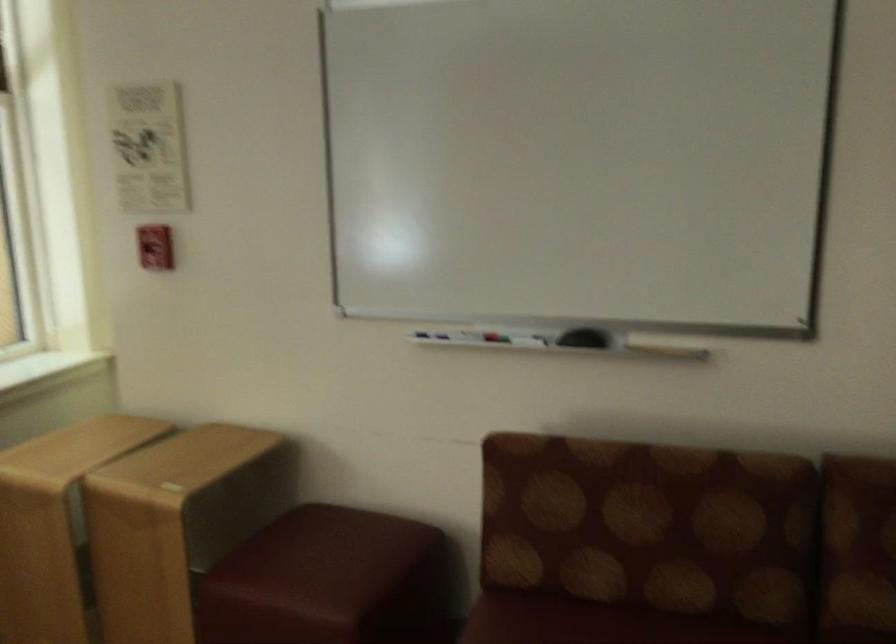
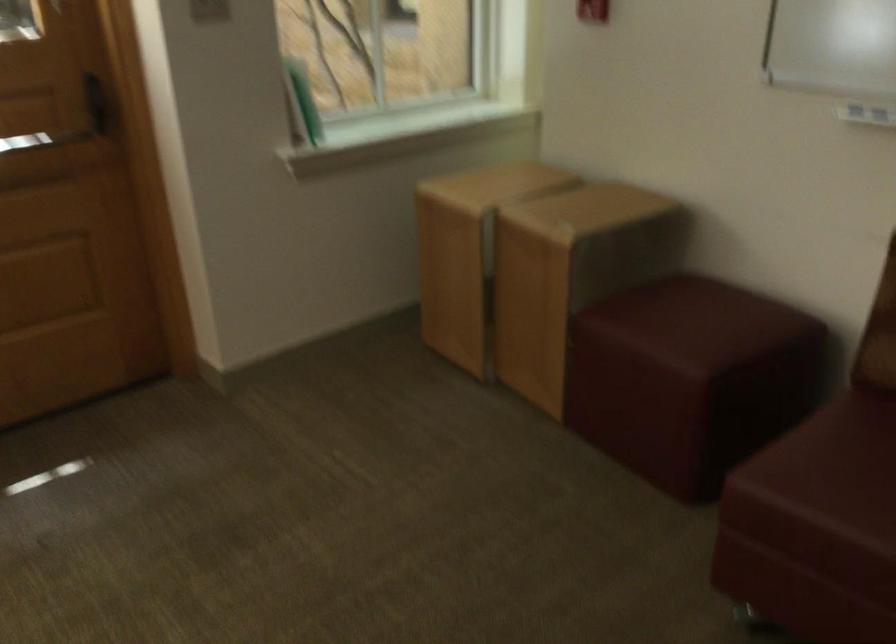
Where in the second image is the point corresponding to point 323,569 from the first image?

(693, 325)